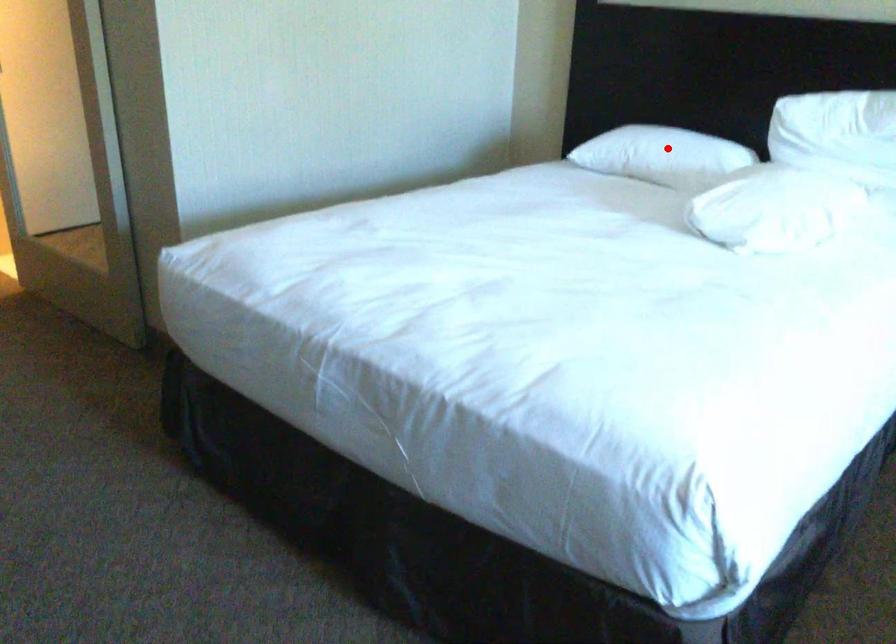
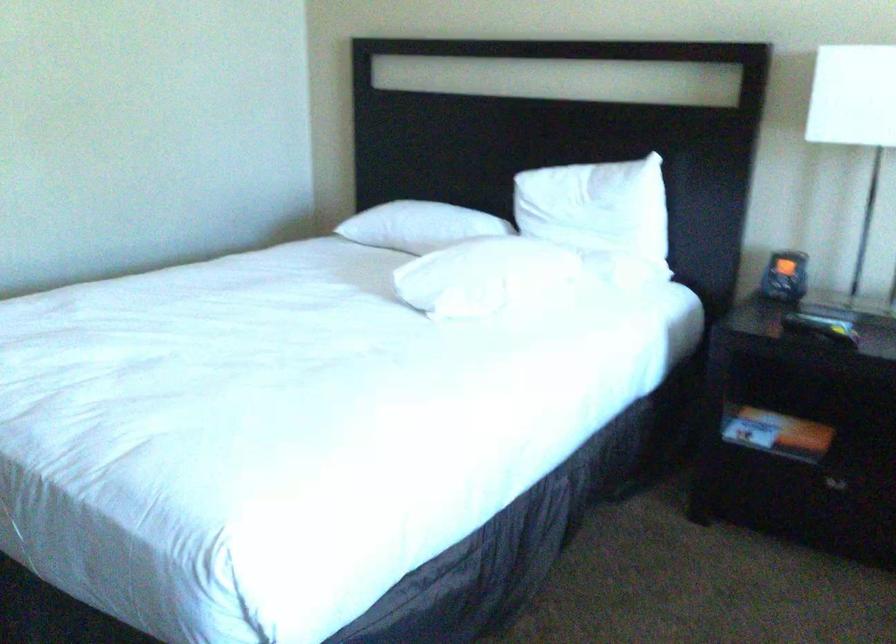
Locate, in the second image, the point that corresponds to the highlighted location in the first image.

(419, 225)